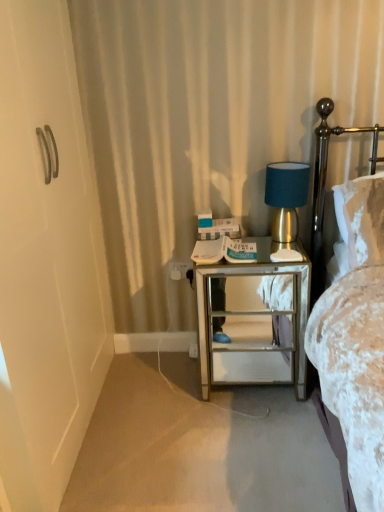
The width and height of the screenshot is (384, 512). I want to click on free space above carpet at lower left (from a real-world perspective), so click(x=201, y=424).